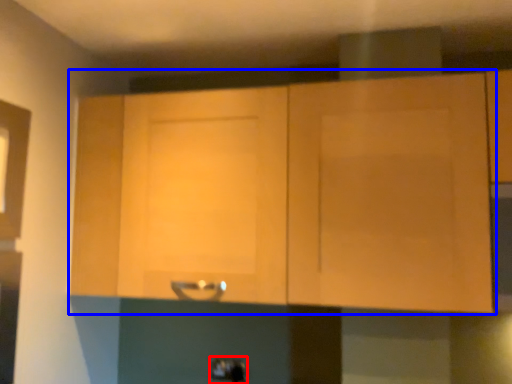
Question: Which object is closer to the camera taking this photo, door handle (highlighted by a red box) or cabinetry (highlighted by a blue box)?

Choices:
 (A) door handle
 (B) cabinetry

Answer: (B)